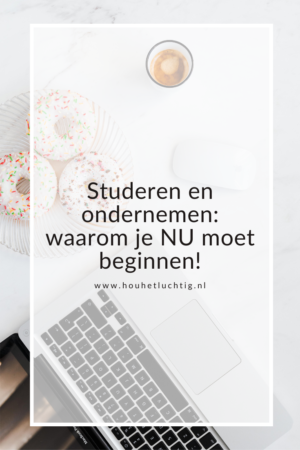
Find the location of a particular element. The height and width of the screenshot is (450, 300). keyboard is located at coordinates (165, 435).